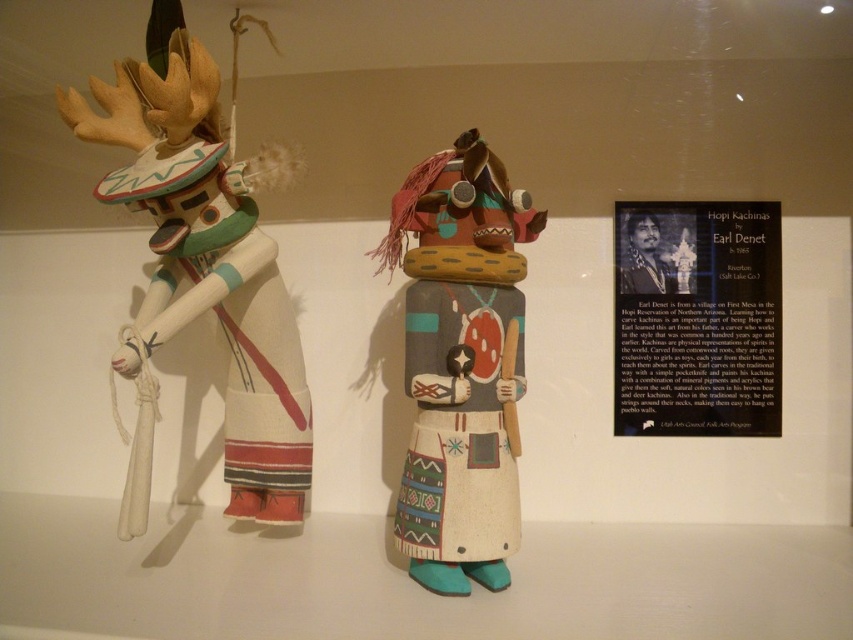
Who is more distant from viewer, (207, 70) or (421, 412)?

Point (421, 412)

What do you see at coordinates (207, 256) in the screenshot?
I see `matte white kachina at left` at bounding box center [207, 256].

At what (x,y) coordinates should I click in order to perform the action: click on matte white kachina at left. Please return your answer as a coordinate pair (x, y). Looking at the image, I should click on (207, 256).